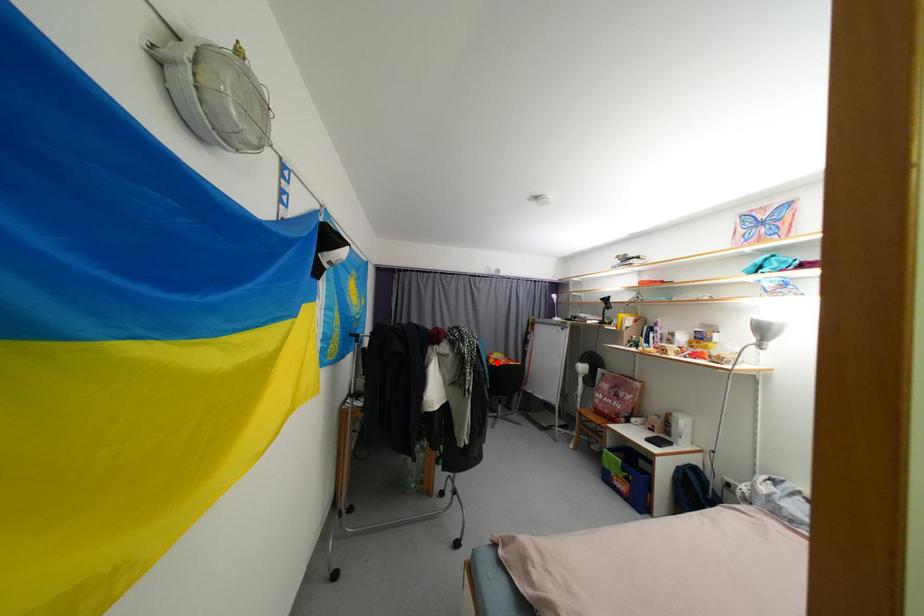
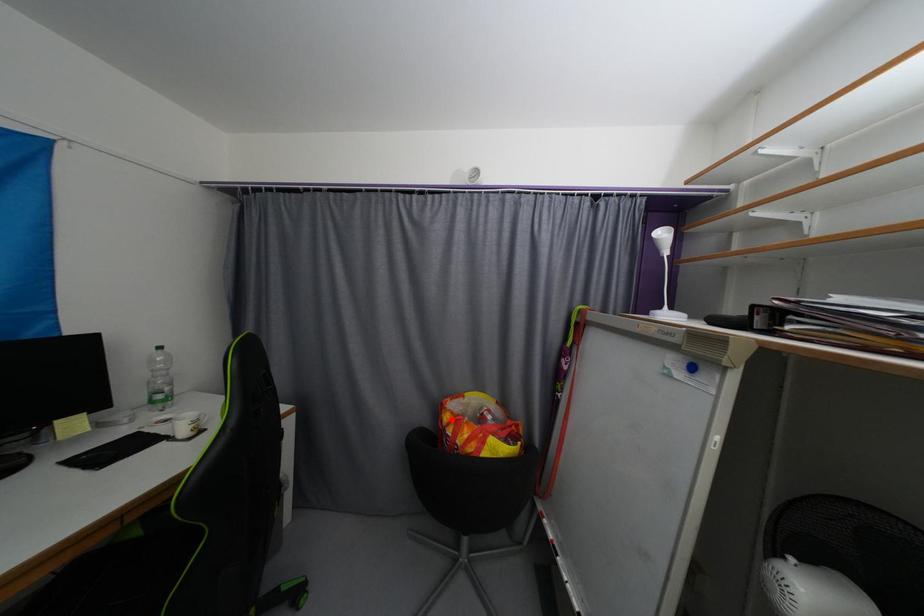
I am providing you with two images of the same scene from different viewpoints. A red point is marked on the first image and another point is marked on the second image. Is the marked point in image1 the same physical position as the marked point in image2?

Yes